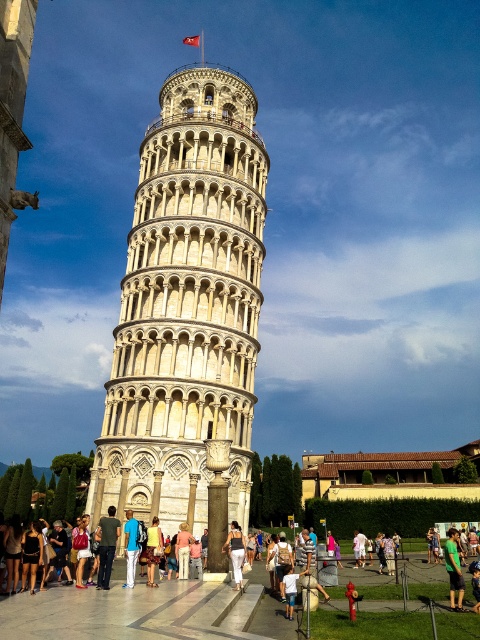
You are standing at the base of the Leaning Tower of Pisa and looking towards the tower. There are two points marked on the tower, one at coordinates point (35, 576) and the other at point (454, 588). Which of these two points is closer to your current position?

Point (35, 576) is closer to the camera than point (454, 588), so the point at coordinates point (35, 576) is closer to your current position.

You are a tourist standing at the base of the Leaning Tower of Pisa. You see the blue denim jeans at center and a camera. If you want to take a photo of the tower with your camera, which object should you hold closer to your face to frame the shot properly?

You should hold the camera closer to your face because the blue denim jeans at center are 29.79 meters away from the camera, so holding the camera closer will allow you to frame the shot properly.

You are standing at the base of the Leaning Tower of Pisa and want to take a photo of a specific point located at coordinates point (x=113, y=544). If your camera has a maximum focus range of 30 meters, will you be able to focus on that point?

The distance of point (x=113, y=544) from the camera is 29.83 meters, which is within the camera maximum focus range of 30 meters. Therefore, you can focus on that point.